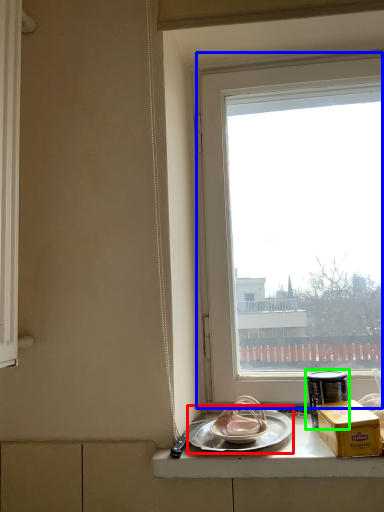
Question: Which is nearer to the plate (highlighted by a red box)? window (highlighted by a blue box) or tableware (highlighted by a green box).

Choices:
 (A) window
 (B) tableware

Answer: (B)